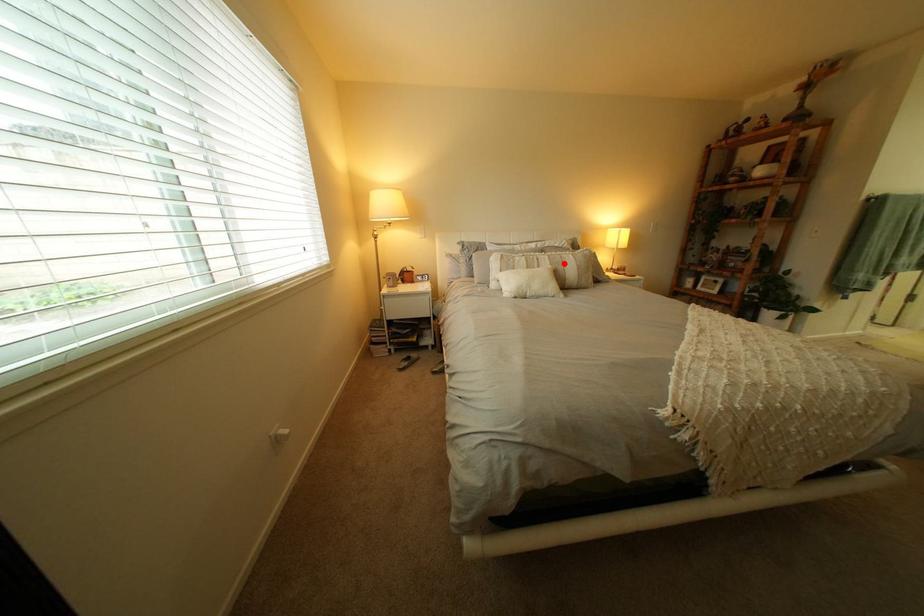
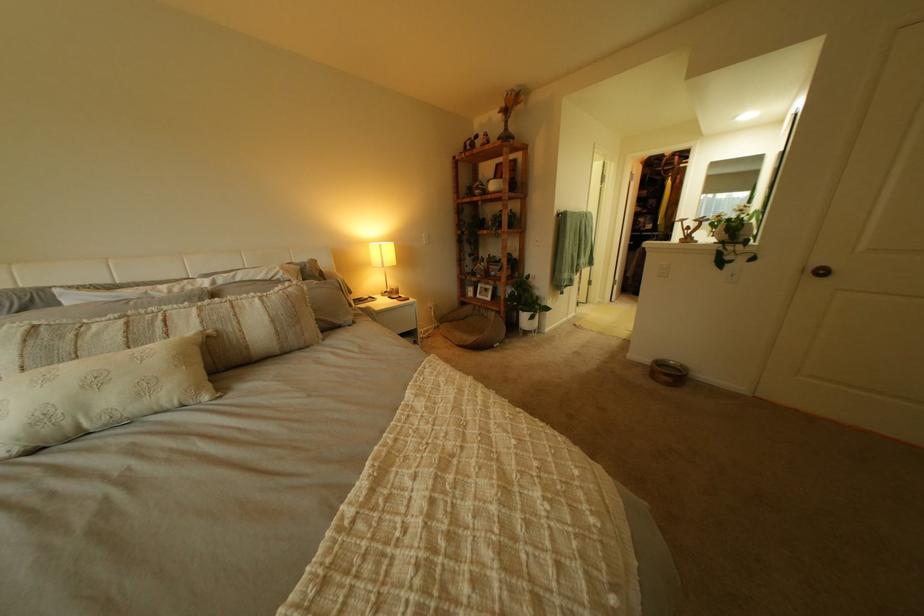
In the second image, find the point that corresponds to the highlighted location in the first image.

(213, 323)